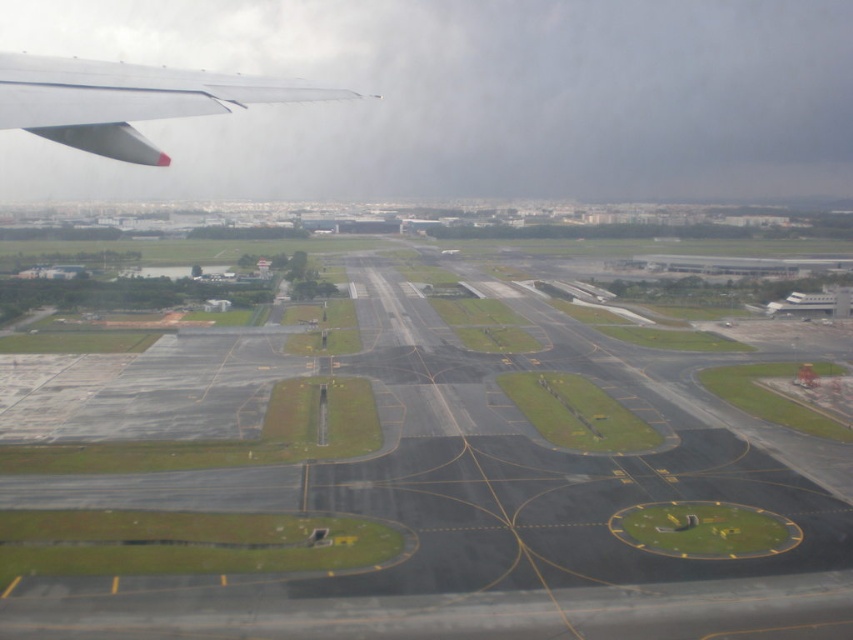
You are a pilot checking the aircraft positioning. From your current position inside the cockpit, you observe the black asphalt tarmac at center and the matte white wing at upper left. Which object appears wider from your viewpoint?

The black asphalt tarmac at center appears wider than the matte white wing at upper left because its width is larger according to the description.

You are a passenger sitting in the aircraft and looking out the window. You notice a point marked as point [440,483]. Can you determine if this point is located on the black asphalt tarmac at center?

The black asphalt tarmac at center is represented by point [440,483], so yes, the point is located on the black asphalt tarmac at center.